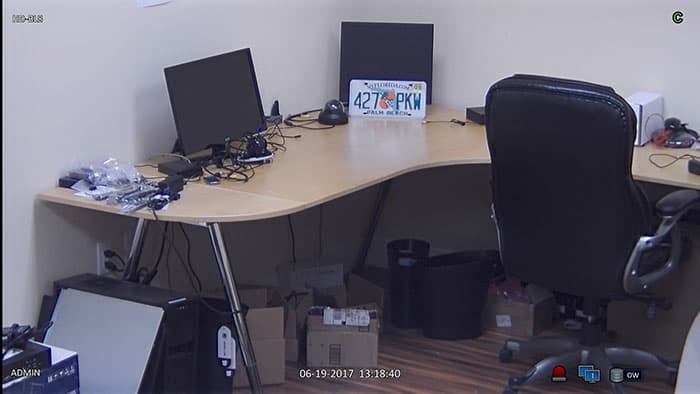
Find the location of `desk`. desk is located at coordinates (321, 175).